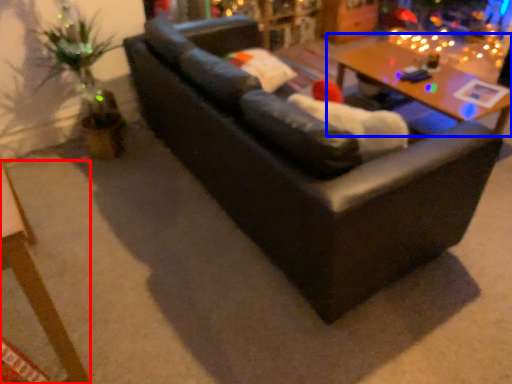
Question: Among these objects, which one is nearest to the camera, table (highlighted by a red box) or table (highlighted by a blue box)?

Choices:
 (A) table
 (B) table

Answer: (A)